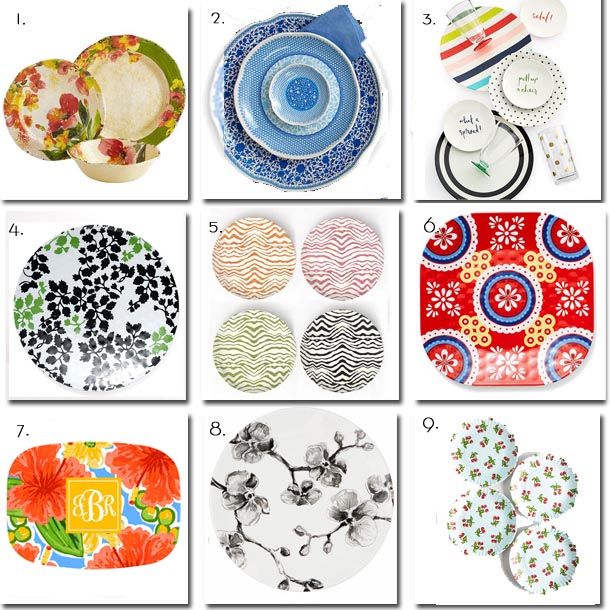
I want to click on plates with flowers, so click(134, 87), click(45, 106).